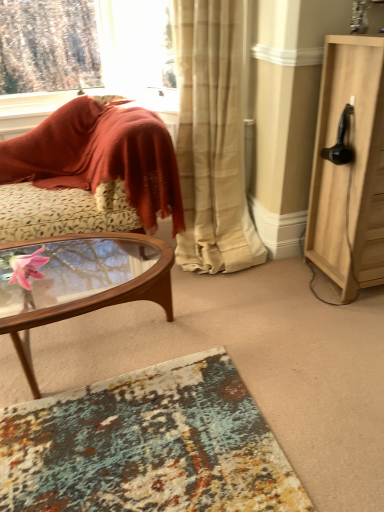
Question: From the image's perspective, would you say textured rug at lower center is positioned over velvet-like rust-colored cushion at left?

Choices:
 (A) no
 (B) yes

Answer: (A)

Question: Is textured rug at lower center facing away from velvet-like rust-colored cushion at left?

Choices:
 (A) no
 (B) yes

Answer: (A)

Question: Can we say textured rug at lower center lies outside velvet-like rust-colored cushion at left?

Choices:
 (A) yes
 (B) no

Answer: (A)

Question: Can you confirm if textured rug at lower center is shorter than velvet-like rust-colored cushion at left?

Choices:
 (A) no
 (B) yes

Answer: (B)

Question: Is textured rug at lower center with velvet-like rust-colored cushion at left?

Choices:
 (A) no
 (B) yes

Answer: (A)

Question: Is the position of textured rug at lower center more distant than that of velvet-like rust-colored cushion at left?

Choices:
 (A) yes
 (B) no

Answer: (B)

Question: Is light wood cabinet at right at the right side of beige sheer curtain at center?

Choices:
 (A) no
 (B) yes

Answer: (B)

Question: Could you tell me if light wood cabinet at right is facing beige sheer curtain at center?

Choices:
 (A) yes
 (B) no

Answer: (B)

Question: Can you confirm if light wood cabinet at right is bigger than beige sheer curtain at center?

Choices:
 (A) no
 (B) yes

Answer: (A)

Question: Is light wood cabinet at right behind beige sheer curtain at center?

Choices:
 (A) no
 (B) yes

Answer: (A)

Question: Does light wood cabinet at right have a smaller size compared to beige sheer curtain at center?

Choices:
 (A) no
 (B) yes

Answer: (B)

Question: Considering the relative sizes of light wood cabinet at right and beige sheer curtain at center in the image provided, is light wood cabinet at right wider than beige sheer curtain at center?

Choices:
 (A) no
 (B) yes

Answer: (A)

Question: Is textured rug at lower center a part of woodenwoodencoffee table at left?

Choices:
 (A) yes
 (B) no

Answer: (B)